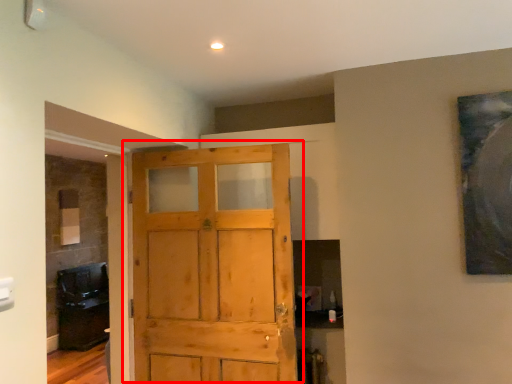
Question: Considering the relative positions of door (annotated by the red box) and cabinetry in the image provided, where is door (annotated by the red box) located with respect to the staircase?

Choices:
 (A) left
 (B) right

Answer: (B)